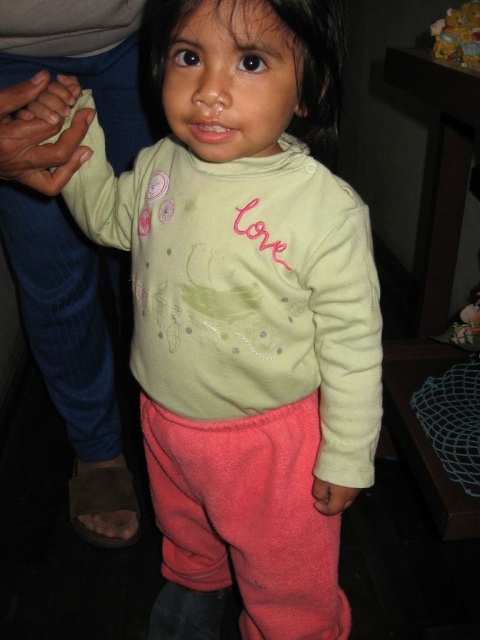
Is point (48, 145) in front of point (349, 502)?

Yes.

Based on the photo, who is shorter, matte yellow hand at left or pink fabric hand at lower center?

pink fabric hand at lower center

Which is behind, point (45, 188) or point (331, 509)?

Positioned behind is point (331, 509).

Locate an element on the screen. The image size is (480, 640). matte yellow hand at left is located at coordinates (37, 140).